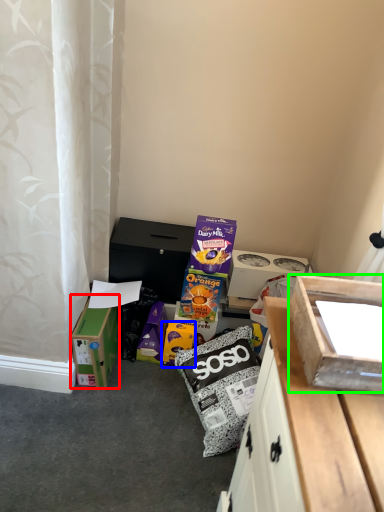
Question: Considering the real-world distances, which object is farthest from box (highlighted by a red box)? cardboard box (highlighted by a blue box) or box (highlighted by a green box)?

Choices:
 (A) cardboard box
 (B) box

Answer: (B)